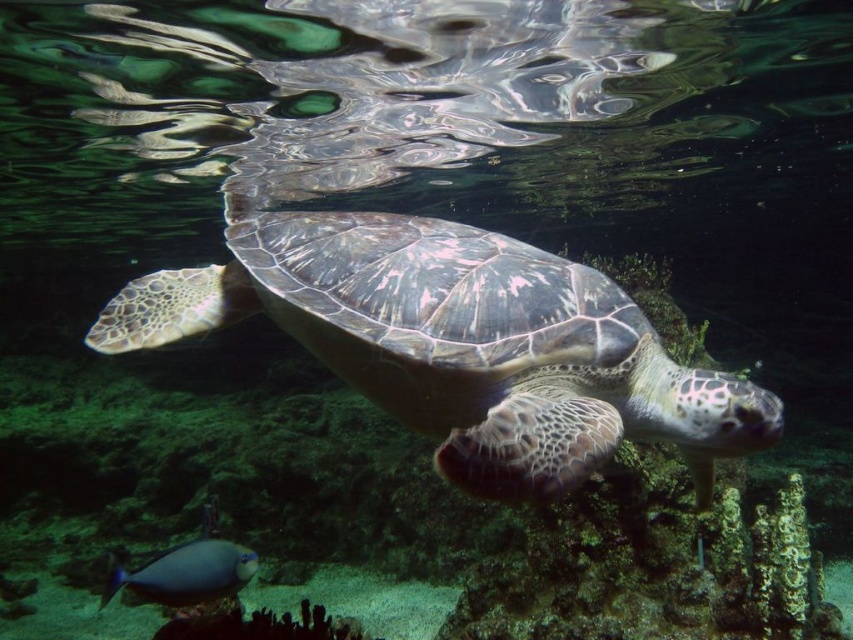
Between point (590, 268) and point (239, 563), which one is positioned behind?

The point (590, 268) is behind.

Where is `leathery green turtle at center`? The width and height of the screenshot is (853, 640). leathery green turtle at center is located at coordinates (457, 342).

Where is `leathery green turtle at center`? leathery green turtle at center is located at coordinates (457, 342).